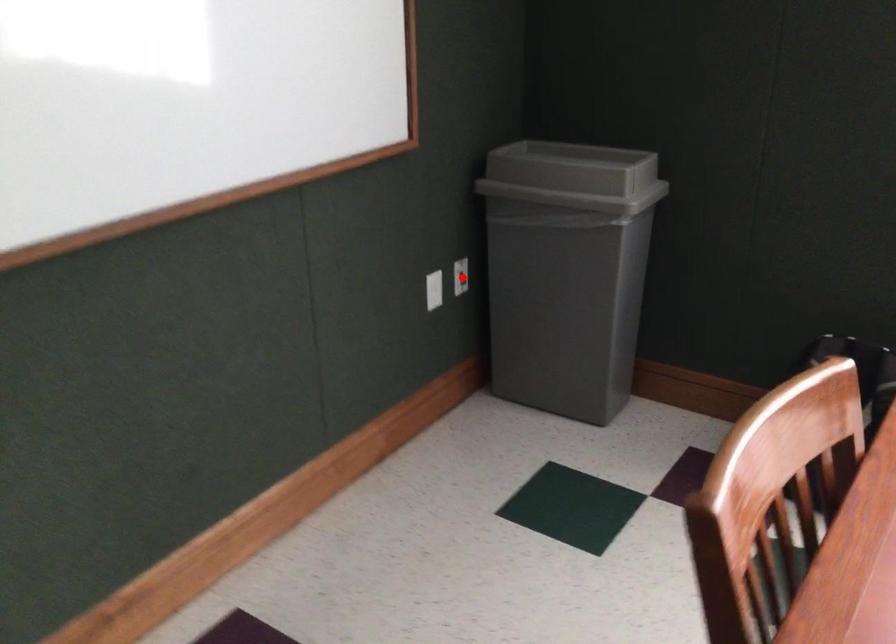
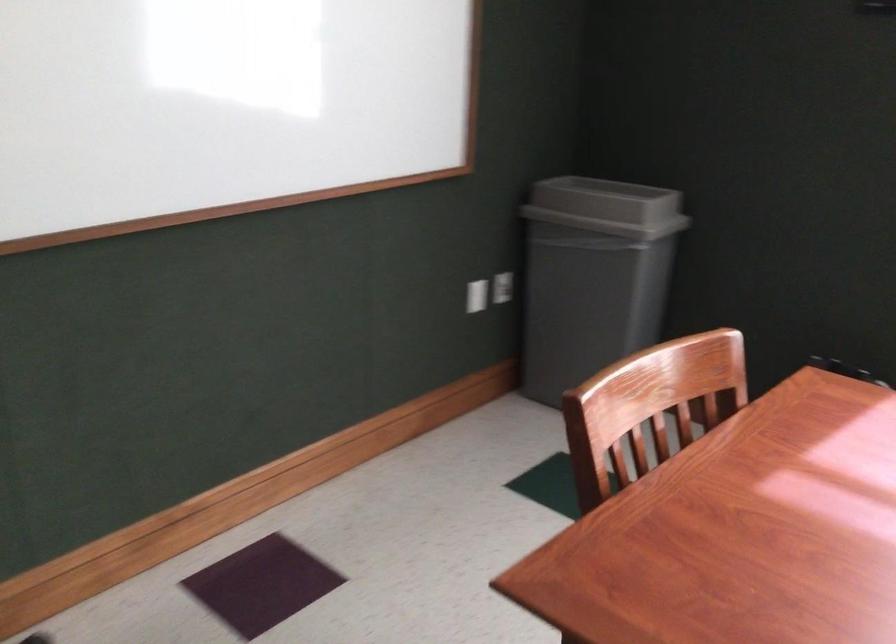
Question: I am providing you with two images of the same scene from different viewpoints. A red point is shown in image1. For the corresponding object point in image2, is it positioned nearer or farther from the camera?

Choices:
 (A) Nearer
 (B) Farther

Answer: (B)